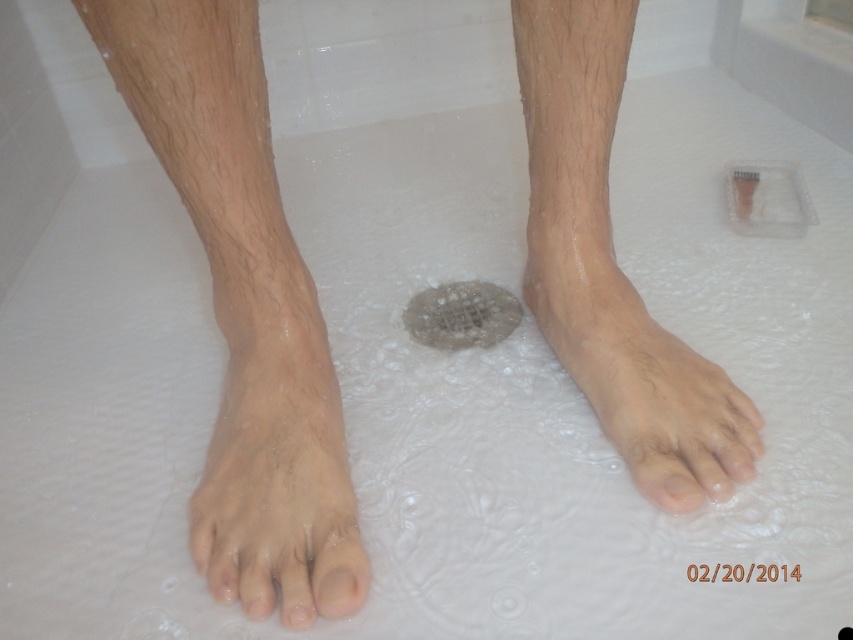
Locate an element on the screen. dry skin at center is located at coordinates click(x=639, y=374).

Does dry skin at center appear on the left side of satin silver drain at center?

Incorrect, dry skin at center is not on the left side of satin silver drain at center.

Is point (693, 432) closer to viewer compared to point (463, 292)?

That is True.

Locate an element on the screen. The height and width of the screenshot is (640, 853). dry skin at center is located at coordinates (639, 374).

Identify the location of dry skin at lower center. The height and width of the screenshot is (640, 853). (612, 268).

Which is more to the right, dry skin at lower center or satin silver drain at center?

From the viewer's perspective, dry skin at lower center appears more on the right side.

Who is more distant from viewer, (761, 420) or (463, 301)?

The point (463, 301) is behind.

The height and width of the screenshot is (640, 853). Find the location of `dry skin at lower center`. dry skin at lower center is located at coordinates (612, 268).

Identify the location of dry skin at left. Image resolution: width=853 pixels, height=640 pixels. (244, 312).

Between point (242, 182) and point (293, 504), which one is positioned behind?

Positioned behind is point (242, 182).

Does point (277, 467) lie in front of point (212, 548)?

No, (277, 467) is further to viewer.

In order to click on dry skin at left in this screenshot , I will do `click(244, 312)`.